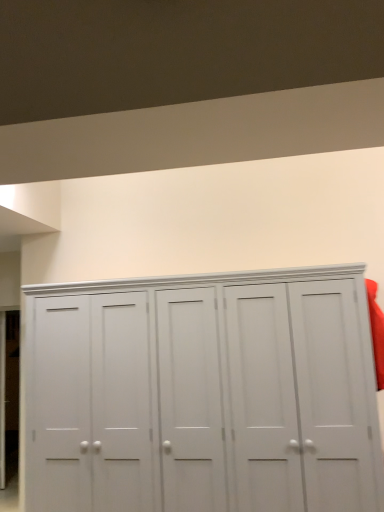
What do you see at coordinates (204, 394) in the screenshot? I see `white painted wood cupboard at center` at bounding box center [204, 394].

The height and width of the screenshot is (512, 384). What are the coordinates of `white painted wood cupboard at center` in the screenshot? It's located at (204, 394).

Identify the location of white painted wood cupboard at center. (204, 394).